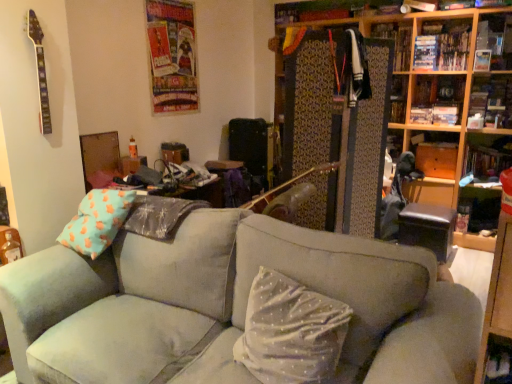
Question: In terms of size, does suede gray couch at center appear bigger or smaller than wooden bookshelf at right, the fourth shelf in the top-to-bottom sequence?

Choices:
 (A) small
 (B) big

Answer: (B)

Question: Choose the correct answer: Is suede gray couch at center inside wooden bookshelf at right, the fourth shelf in the top-to-bottom sequence, or outside it?

Choices:
 (A) outside
 (B) inside

Answer: (A)

Question: Which object is the farthest from the wooden bookshelf at upper right?

Choices:
 (A) wooden bookshelf at right, marked as the first shelf in a bottom-to-top arrangement
 (B) wooden cabinet at upper right, the 3th shelf when ordered from top to bottom
 (C) white dotted fabric pillow at center
 (D) wooden bookshelf at upper right, the third shelf positioned from the bottom
 (E) suede gray couch at center

Answer: (C)

Question: Estimate the real-world distances between objects in this image. Which object is farther from the wooden bookshelf at upper right?

Choices:
 (A) hardcover book at upper right
 (B) white dotted fabric pillow at center
 (C) wooden cabinet at upper right, the second shelf when ordered from bottom to top
 (D) wooden bookshelf at upper right, the first shelf in the top-to-bottom sequence
 (E) wooden bookshelf at upper right, the third shelf positioned from the bottom

Answer: (B)